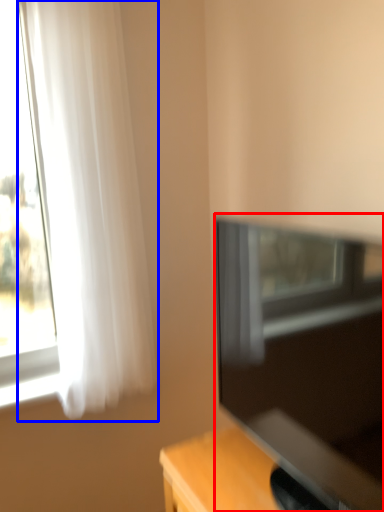
Question: Which point is closer to the camera, television (highlighted by a red box) or curtain (highlighted by a blue box)?

Choices:
 (A) television
 (B) curtain

Answer: (A)